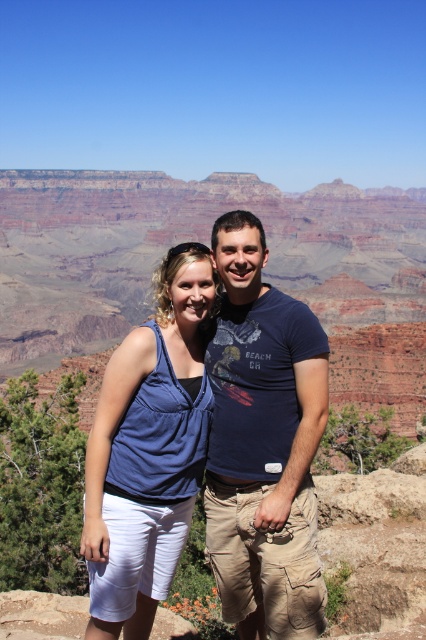
Looking at this image, does dark blue cotton t-shirt at center appear under blue fabric tank top at center?

Incorrect, dark blue cotton t-shirt at center is not positioned below blue fabric tank top at center.

Locate an element on the screen. This screenshot has width=426, height=640. dark blue cotton t-shirt at center is located at coordinates (264, 444).

Find the location of `dark blue cotton t-shirt at center`. dark blue cotton t-shirt at center is located at coordinates (264, 444).